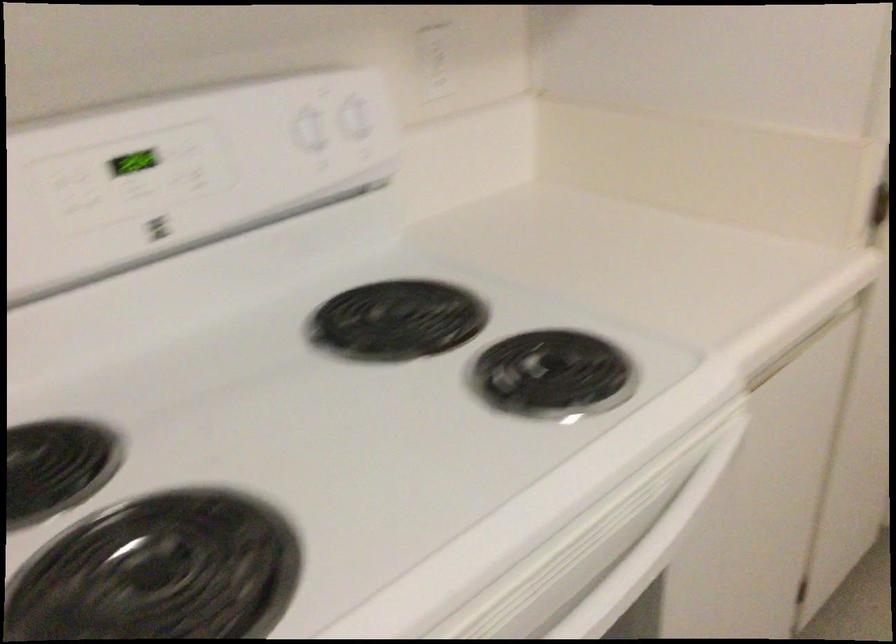
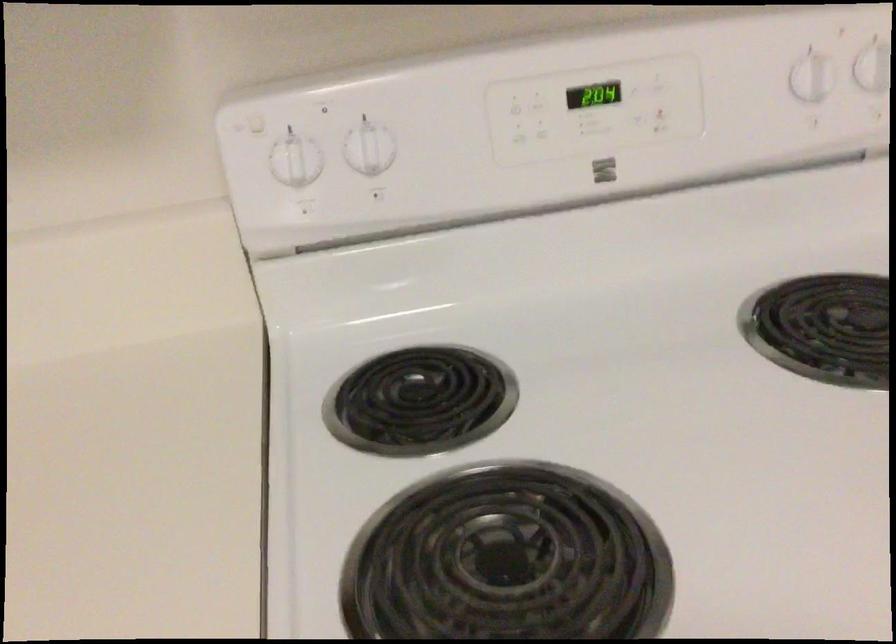
Where in the second image is the point corresponding to point (358, 128) from the first image?

(873, 68)